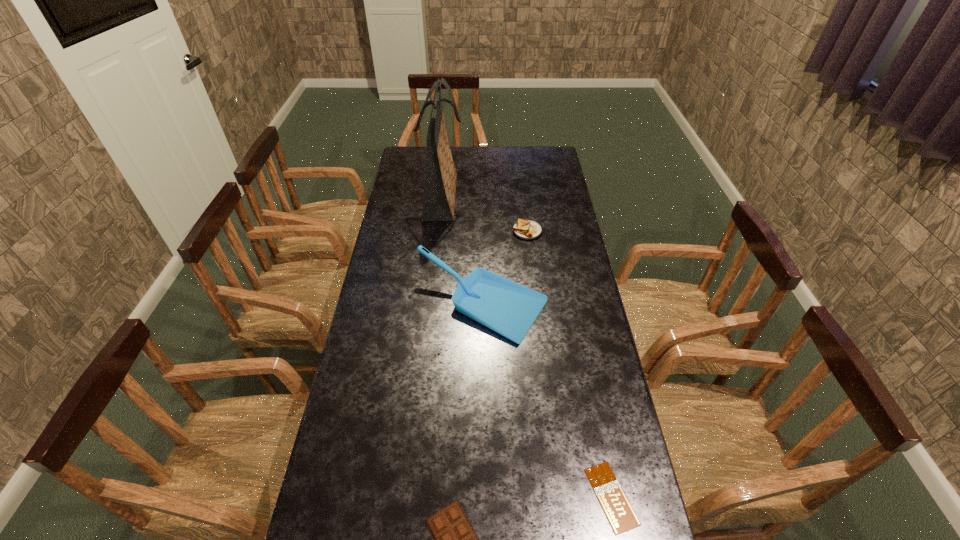
Where is `blank space that satisfies the following two spatial constraints: 1. on the front-facing side of the farthest object; 2. on the back side of the fourth shortest object`? The width and height of the screenshot is (960, 540). blank space that satisfies the following two spatial constraints: 1. on the front-facing side of the farthest object; 2. on the back side of the fourth shortest object is located at coordinates (431, 306).

Locate an element on the screen. The image size is (960, 540). vacant region that satisfies the following two spatial constraints: 1. on the back side of the shorter chocolate bar; 2. on the front-facing side of the farthest object is located at coordinates (552, 196).

Identify the location of vacant area in the image that satisfies the following two spatial constraints: 1. on the back side of the fourth nearest object; 2. on the front-facing side of the shopping bag. (523, 196).

Where is `vacant space that satisfies the following two spatial constraints: 1. on the front side of the dustpan; 2. on the left side of the shortest object`? The image size is (960, 540). vacant space that satisfies the following two spatial constraints: 1. on the front side of the dustpan; 2. on the left side of the shortest object is located at coordinates (483, 496).

Where is `free location that satisfies the following two spatial constraints: 1. on the front side of the shorter chocolate bar; 2. on the left side of the third nearest object`? free location that satisfies the following two spatial constraints: 1. on the front side of the shorter chocolate bar; 2. on the left side of the third nearest object is located at coordinates (483, 496).

At what (x,y) coordinates should I click in order to perform the action: click on free space that satisfies the following two spatial constraints: 1. on the front-facing side of the farthest object; 2. on the back side of the sandwich. Please return your answer as a coordinate pair (x, y). This screenshot has height=540, width=960. Looking at the image, I should click on (439, 231).

Locate an element on the screen. The width and height of the screenshot is (960, 540). vacant space that satisfies the following two spatial constraints: 1. on the front-facing side of the shopping bag; 2. on the left side of the shortest object is located at coordinates (411, 496).

Where is `free location that satisfies the following two spatial constraints: 1. on the front-facing side of the rightmost object; 2. on the left side of the shopping bag`? free location that satisfies the following two spatial constraints: 1. on the front-facing side of the rightmost object; 2. on the left side of the shopping bag is located at coordinates (411, 496).